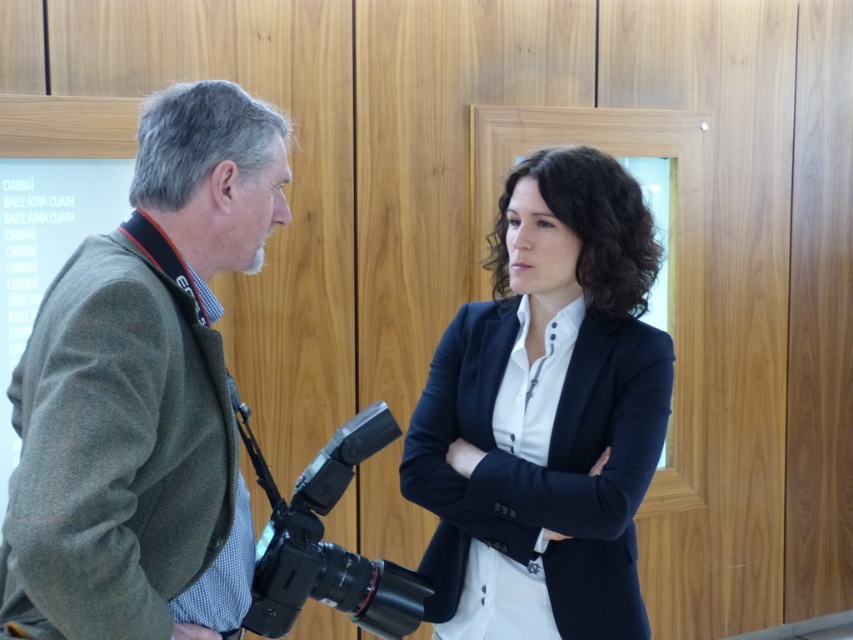
Can you confirm if green wool jacket at left is positioned to the right of navy blue blazer at center?

In fact, green wool jacket at left is to the left of navy blue blazer at center.

Can you confirm if green wool jacket at left is smaller than navy blue blazer at center?

Yes, green wool jacket at left is smaller than navy blue blazer at center.

Locate an element on the screen. The image size is (853, 640). green wool jacket at left is located at coordinates (143, 388).

Based on the photo, can you confirm if green wool jacket at left is positioned below black plastic video camera at center?

Incorrect, green wool jacket at left is not positioned below black plastic video camera at center.

In the scene shown: Is green wool jacket at left positioned behind black plastic video camera at center?

→ No.

Is point (236, 228) in front of point (286, 598)?

Yes, point (236, 228) is closer to viewer.

The width and height of the screenshot is (853, 640). I want to click on green wool jacket at left, so pyautogui.click(x=143, y=388).

Is point (619, 372) more distant than point (299, 522)?

Yes, it is behind point (299, 522).

Is point (636, 419) positioned behind point (425, 582)?

No.

Locate an element on the screen. This screenshot has height=640, width=853. navy blue blazer at center is located at coordinates click(x=544, y=413).